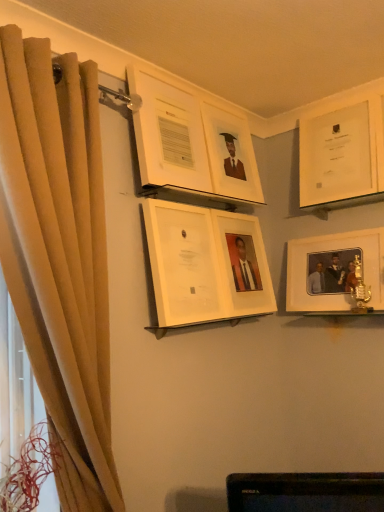
Question: Which direction should I rotate to face white glossy picture frame at center, which is the fifth picture frame in right-to-left order, — up or down?

Choices:
 (A) down
 (B) up

Answer: (A)

Question: Is beige fabric curtain at left positioned beyond the bounds of white glossy picture frame at upper center, the 1th picture frame when ordered from left to right?

Choices:
 (A) yes
 (B) no

Answer: (A)

Question: Does beige fabric curtain at left have a greater height compared to white glossy picture frame at upper center, positioned as the sixth picture frame in right-to-left order?

Choices:
 (A) yes
 (B) no

Answer: (A)

Question: Is beige fabric curtain at left not close to white glossy picture frame at upper center, the 1th picture frame when ordered from left to right?

Choices:
 (A) yes
 (B) no

Answer: (B)

Question: Is beige fabric curtain at left positioned with its back to white glossy picture frame at upper center, the 1th picture frame when ordered from left to right?

Choices:
 (A) no
 (B) yes

Answer: (A)

Question: Considering the relative positions of beige fabric curtain at left and white glossy picture frame at upper center, the 1th picture frame when ordered from left to right, in the image provided, is beige fabric curtain at left to the right of white glossy picture frame at upper center, the 1th picture frame when ordered from left to right, from the viewer's perspective?

Choices:
 (A) yes
 (B) no

Answer: (B)

Question: From the image's perspective, does beige fabric curtain at left appear lower than white glossy picture frame at upper center, the 1th picture frame when ordered from left to right?

Choices:
 (A) yes
 (B) no

Answer: (A)

Question: Is white glossy picture frame at upper right, acting as the first picture frame starting from the right, in contact with white glossy picture frame at upper center, positioned as the sixth picture frame in right-to-left order?

Choices:
 (A) yes
 (B) no

Answer: (B)

Question: Is white glossy picture frame at upper right, acting as the first picture frame starting from the right, to the left of white glossy picture frame at upper center, positioned as the sixth picture frame in right-to-left order, from the viewer's perspective?

Choices:
 (A) no
 (B) yes

Answer: (A)

Question: Considering the relative sizes of white glossy picture frame at upper right, the 6th picture frame viewed from the left, and white glossy picture frame at upper center, positioned as the sixth picture frame in right-to-left order, in the image provided, is white glossy picture frame at upper right, the 6th picture frame viewed from the left, shorter than white glossy picture frame at upper center, positioned as the sixth picture frame in right-to-left order,?

Choices:
 (A) no
 (B) yes

Answer: (A)

Question: From a real-world perspective, does white glossy picture frame at upper right, the 6th picture frame viewed from the left, stand above white glossy picture frame at upper center, the 1th picture frame when ordered from left to right?

Choices:
 (A) no
 (B) yes

Answer: (A)

Question: Is white glossy picture frame at upper right, acting as the first picture frame starting from the right, not close to white glossy picture frame at upper center, the 1th picture frame when ordered from left to right?

Choices:
 (A) no
 (B) yes

Answer: (A)

Question: Is the position of white glossy picture frame at upper right, the 6th picture frame viewed from the left, less distant than that of white glossy picture frame at upper center, positioned as the sixth picture frame in right-to-left order?

Choices:
 (A) yes
 (B) no

Answer: (B)

Question: Is white matte picture frame at right, marked as the 2th picture frame in a right-to-left arrangement, thinner than matte white picture frame at upper center, acting as the third picture frame starting from the left?

Choices:
 (A) no
 (B) yes

Answer: (A)